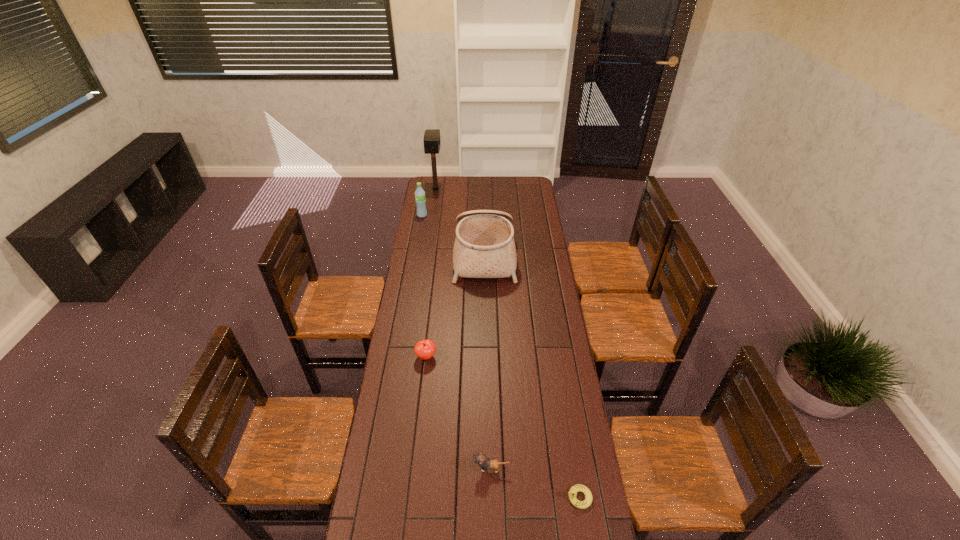
Locate an element on the screen. The image size is (960, 540). vacant space located 0.220m with the lid open on the basket is located at coordinates (412, 255).

At what (x,y) coordinates should I click in order to perform the action: click on vacant area situated with the lid open on the basket. Please return your answer as a coordinate pair (x, y). Looking at the image, I should click on (409, 255).

The width and height of the screenshot is (960, 540). In order to click on vacant space located with the lid open on the basket in this screenshot , I will do `click(441, 255)`.

Identify the location of vacant space located on the right of the water bottle. (492, 215).

Find the location of a particular element. free space located on the back of the fourth farthest object is located at coordinates pos(433,297).

Where is `vacant area located on the front-facing side of the kitten`? The height and width of the screenshot is (540, 960). vacant area located on the front-facing side of the kitten is located at coordinates (370, 469).

At what (x,y) coordinates should I click in order to perform the action: click on vacant position located 0.350m on the front-facing side of the kitten. Please return your answer as a coordinate pair (x, y). The height and width of the screenshot is (540, 960). Looking at the image, I should click on (370, 469).

Identify the location of vacant space located on the front-facing side of the kitten. This screenshot has width=960, height=540. (370, 469).

Find the location of a particular element. The image size is (960, 540). free space located 0.190m on the face of the rightmost object is located at coordinates (508, 497).

In order to click on vacant region located 0.360m on the face of the rightmost object in this screenshot , I will do `click(455, 497)`.